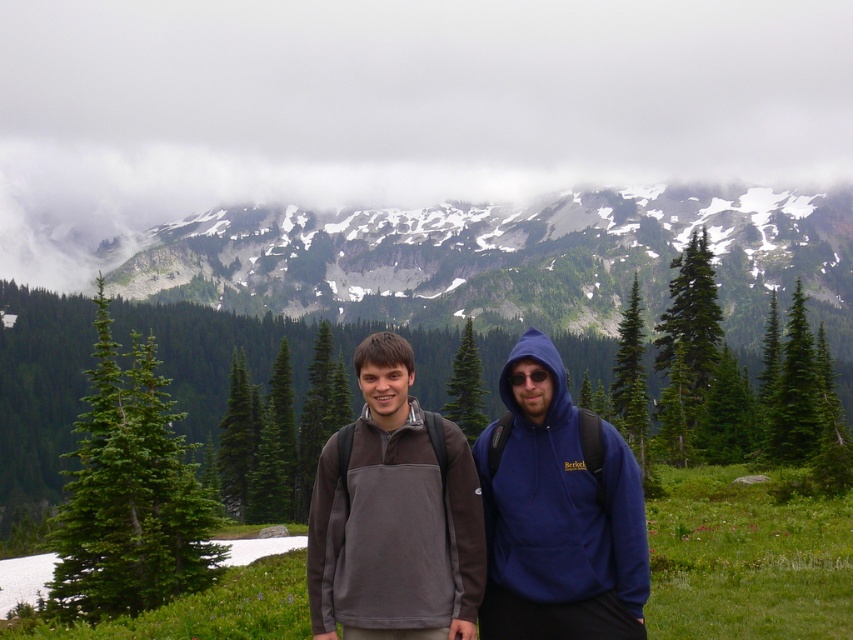
You are planning to take a photo of the white fluffy cloud at upper center and the green matte pine at left. Which object would appear larger in the photo?

The white fluffy cloud at upper center would appear larger in the photo because it is much taller than the green matte pine at left according to the description.

You are a photographer planning to take a photo of the white fluffy cloud at upper center. The camera you are using has a maximum focus range of 400 meters. Can you capture the cloud clearly?

The white fluffy cloud at upper center is 385.48 meters away from the camera. Since the camera can focus up to 400 meters, it is within the range, so yes, you can capture the cloud clearly.